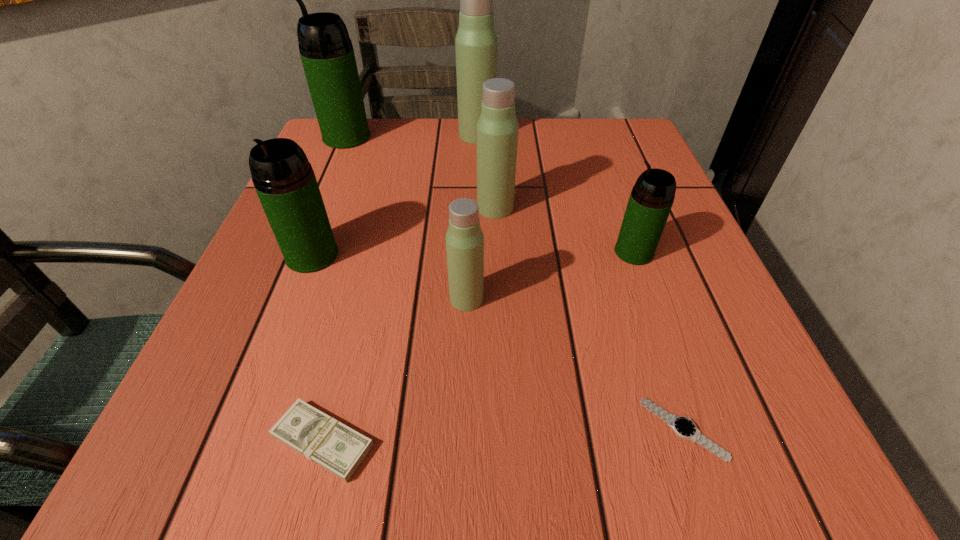
Find the location of `money located at the near edge`. money located at the near edge is located at coordinates (337, 448).

This screenshot has height=540, width=960. Find the location of `watch at the near edge`. watch at the near edge is located at coordinates (683, 427).

This screenshot has width=960, height=540. Find the location of `money that is at the left edge`. money that is at the left edge is located at coordinates point(337,448).

The height and width of the screenshot is (540, 960). Find the location of `thermos bottle that is at the right edge`. thermos bottle that is at the right edge is located at coordinates (651, 199).

Where is `watch present at the right edge`? The width and height of the screenshot is (960, 540). watch present at the right edge is located at coordinates 683,427.

What are the coordinates of `object at the far left corner` in the screenshot? It's located at (327, 54).

This screenshot has height=540, width=960. I want to click on object situated at the near left corner, so click(337, 448).

At what (x,y) coordinates should I click in order to perform the action: click on object present at the near right corner. Please return your answer as a coordinate pair (x, y). The width and height of the screenshot is (960, 540). Looking at the image, I should click on (683, 427).

At what (x,y) coordinates should I click in order to perform the action: click on free space at the far edge of the desktop. Please return your answer as a coordinate pair (x, y). The height and width of the screenshot is (540, 960). Looking at the image, I should click on 464,156.

You are a GUI agent. You are given a task and a screenshot of the screen. Output one action in this format:
    pyautogui.click(x=<x>, y=<y>)
    Task: Click on the vacant region at the left edge
    
    Given the screenshot: What is the action you would take?
    pyautogui.click(x=281, y=342)